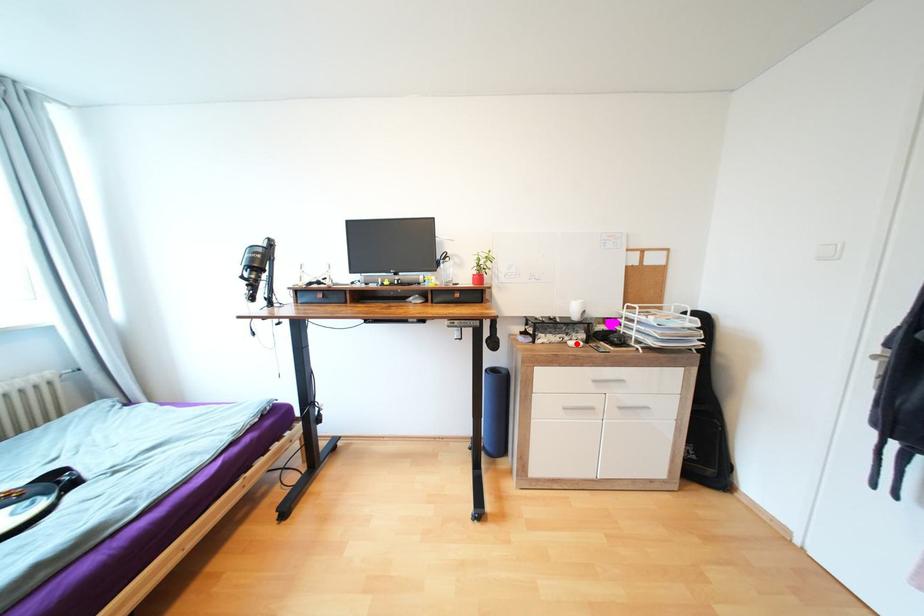
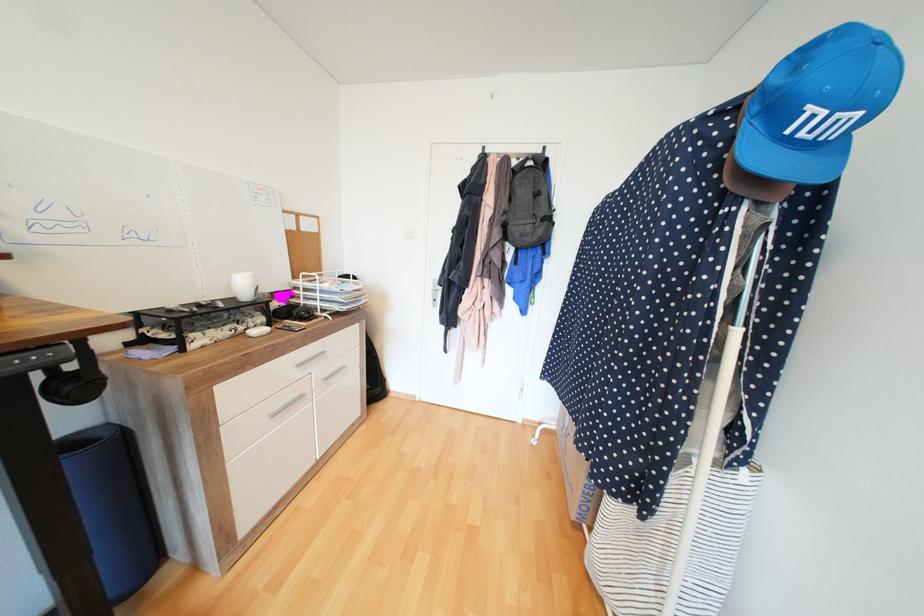
The point at the highlighted location is marked in the first image. Where is the corresponding point in the second image?

(260, 333)